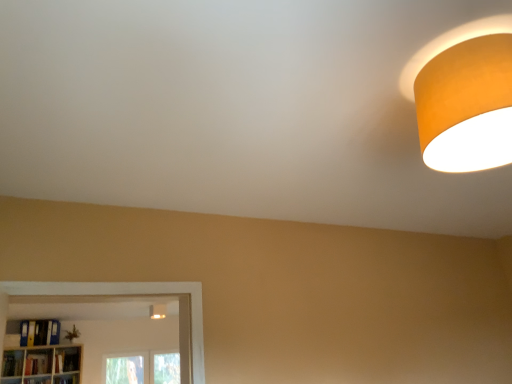
Question: From the image's perspective, is yellow matte folder at lower left, which is counted as the second book, starting from the right, located above matte white light fixture at lower center, placed as the first lamp when sorted from bottom to top?

Choices:
 (A) no
 (B) yes

Answer: (A)

Question: Does yellow matte folder at lower left, positioned as the third book in left-to-right order, appear on the right side of matte white light fixture at lower center, placed as the first lamp when sorted from bottom to top?

Choices:
 (A) yes
 (B) no

Answer: (B)

Question: Is yellow matte folder at lower left, positioned as the third book in left-to-right order, smaller than matte white light fixture at lower center, marked as the first lamp in a left-to-right arrangement?

Choices:
 (A) yes
 (B) no

Answer: (B)

Question: Can you confirm if yellow matte folder at lower left, which is counted as the second book, starting from the right, is thinner than matte white light fixture at lower center, acting as the 1th lamp starting from the back?

Choices:
 (A) no
 (B) yes

Answer: (A)

Question: Considering the relative sizes of yellow matte folder at lower left, which is counted as the second book, starting from the right, and matte white light fixture at lower center, acting as the 1th lamp starting from the back, in the image provided, is yellow matte folder at lower left, which is counted as the second book, starting from the right, wider than matte white light fixture at lower center, acting as the 1th lamp starting from the back,?

Choices:
 (A) yes
 (B) no

Answer: (A)

Question: Can you confirm if yellow matte folder at lower left, which is counted as the second book, starting from the right, is positioned to the left of matte white light fixture at lower center, acting as the 2th lamp starting from the right?

Choices:
 (A) no
 (B) yes

Answer: (B)

Question: Is matte white light fixture at lower center, placed as the second lamp when sorted from front to back, aimed at hardcover book at lower left, which ranks as the 4th book in right-to-left order?

Choices:
 (A) no
 (B) yes

Answer: (A)

Question: Is matte white light fixture at lower center, which ranks as the second lamp in top-to-bottom order, surrounding hardcover book at lower left, which ranks as the 4th book in right-to-left order?

Choices:
 (A) yes
 (B) no

Answer: (B)

Question: Is the surface of matte white light fixture at lower center, marked as the first lamp in a left-to-right arrangement, in direct contact with hardcover book at lower left, which ranks as the 4th book in right-to-left order?

Choices:
 (A) yes
 (B) no

Answer: (B)

Question: Is matte white light fixture at lower center, acting as the 2th lamp starting from the right, not close to hardcover book at lower left, the 1th book when ordered from left to right?

Choices:
 (A) no
 (B) yes

Answer: (A)

Question: Considering the relative positions of matte white light fixture at lower center, acting as the 2th lamp starting from the right, and hardcover book at lower left, which ranks as the 4th book in right-to-left order, in the image provided, is matte white light fixture at lower center, acting as the 2th lamp starting from the right, behind hardcover book at lower left, which ranks as the 4th book in right-to-left order,?

Choices:
 (A) yes
 (B) no

Answer: (A)

Question: From the image's perspective, is matte white light fixture at lower center, marked as the first lamp in a left-to-right arrangement, above hardcover book at lower left, which ranks as the 4th book in right-to-left order?

Choices:
 (A) no
 (B) yes

Answer: (B)

Question: Does orange matte lampshade at upper right, arranged as the second lamp when viewed from the back, have a lesser width compared to hardcover book at lower left, positioned as the first book in right-to-left order?

Choices:
 (A) yes
 (B) no

Answer: (B)